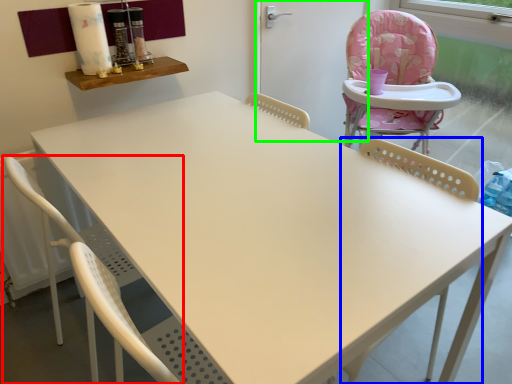
Question: Based on their relative distances, which object is farther from chair (highlighted by a red box)? Choose from chair (highlighted by a blue box) and screen door (highlighted by a green box).

Choices:
 (A) chair
 (B) screen door

Answer: (B)